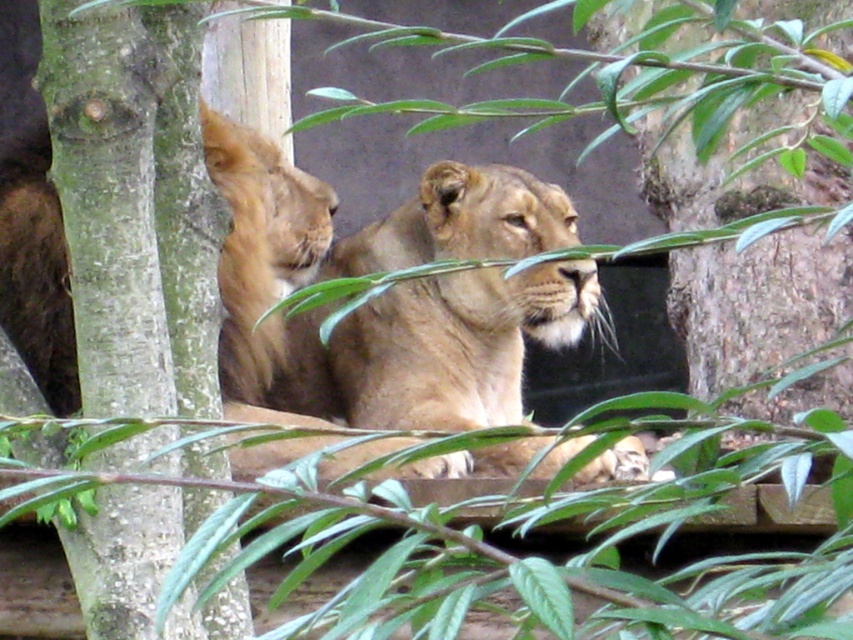
From the picture: You are a zookeeper observing the lions in their enclosure. You notice a point marked at coordinates (135, 204). Based on the scene description, what object does this point most likely correspond to?

The point at coordinates (135, 204) corresponds to the green rough bark at left.

You are a zookeeper trying to place a new feeding station in the enclosure. The feeding station requires a clear space of 1 meter in diameter. Can you place it near the green rough bark at left without overlapping any other objects?

The green rough bark at left is located at point (x=135, y=204). Since there are no other objects mentioned near this location, the feeding station can be placed there as long as there are no unseen obstacles.

You are a zookeeper planning to place a new feeding tray for the golden fur lion at center. The tray needs to be placed below the green rough bark at left to avoid blocking the lion from seeing the entrance. Can you position the feeding tray there?

The green rough bark at left is above the golden fur lion at center, so placing the feeding tray below the green rough bark at left would be possible without blocking the lion from seeing the entrance.